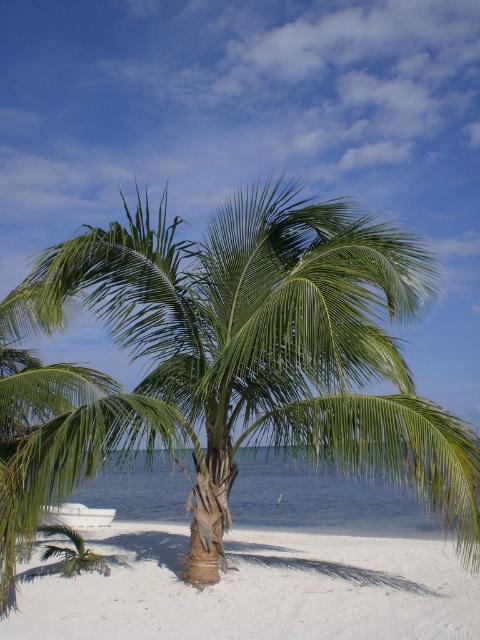
You are standing on the white sandy beach at center and looking towards the green leafy palm tree at center. Which object is higher in elevation?

The green leafy palm tree at center is higher in elevation than the white sandy beach at center.

You are standing on the beach and see the point marked at coordinates (248,360). Based on the scene description, can you tell me what object this point is located on?

The point at coordinates (248,360) is located on the green leafy palm tree at center.